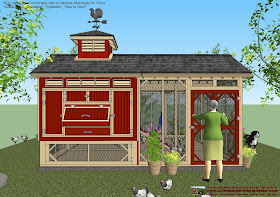
Locate an element on the screen. door is located at coordinates 202,109.